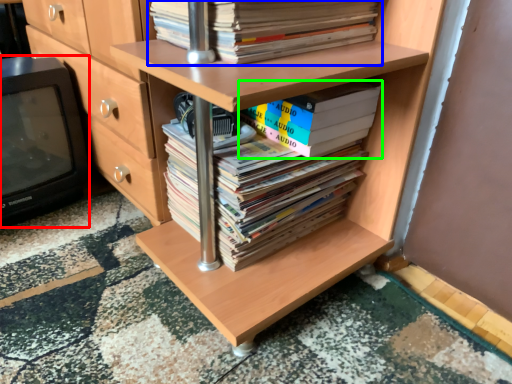
Question: Which object is positioned closest to wide (highlighted by a red box)? Select from book (highlighted by a blue box) and book (highlighted by a green box).

Choices:
 (A) book
 (B) book

Answer: (A)